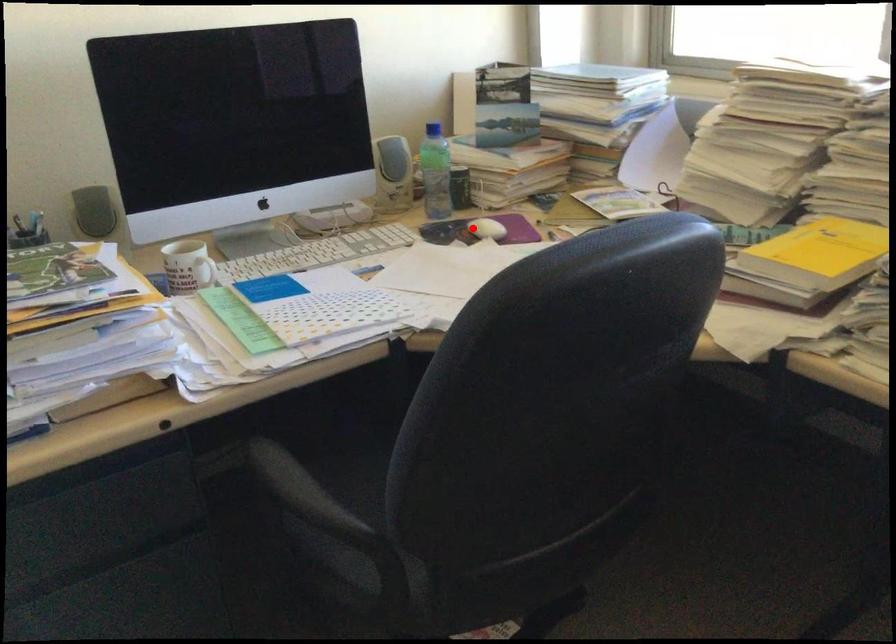
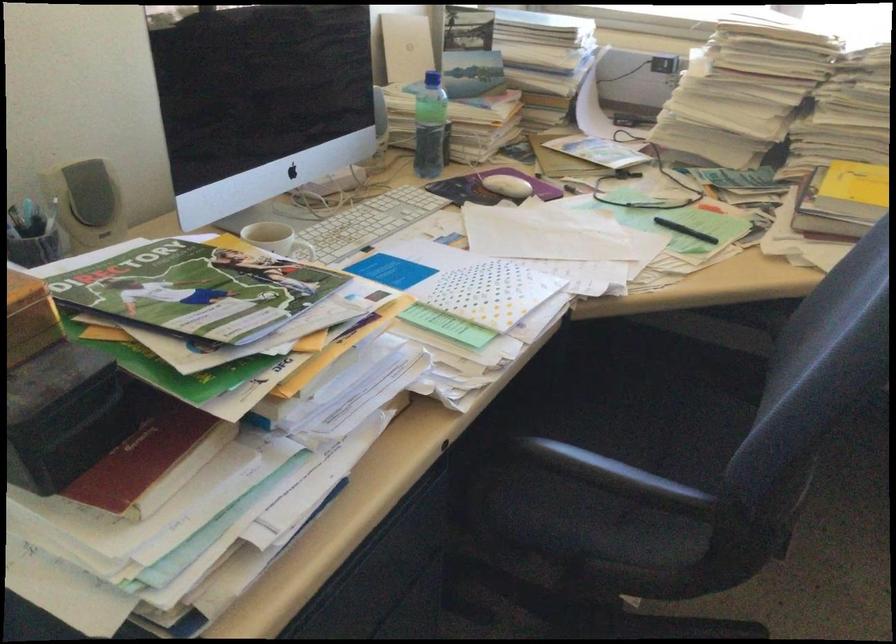
The point at the highlighted location is marked in the first image. Where is the corresponding point in the second image?

(506, 185)